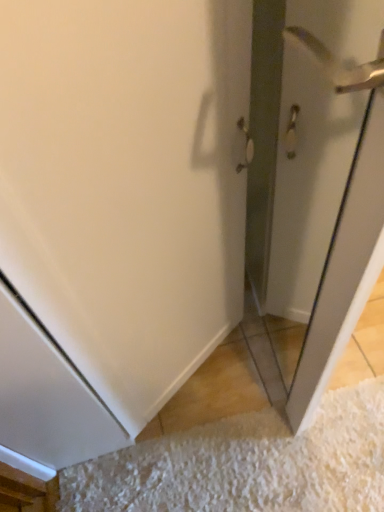
Question: Is clear glass screen door at right bigger than white textured doormat at lower right?

Choices:
 (A) yes
 (B) no

Answer: (A)

Question: Is clear glass screen door at right with white textured doormat at lower right?

Choices:
 (A) yes
 (B) no

Answer: (B)

Question: Is clear glass screen door at right at the left side of white textured doormat at lower right?

Choices:
 (A) no
 (B) yes

Answer: (A)

Question: Considering the relative positions of clear glass screen door at right and white textured doormat at lower right in the image provided, is clear glass screen door at right behind white textured doormat at lower right?

Choices:
 (A) no
 (B) yes

Answer: (A)

Question: Is clear glass screen door at right far from white textured doormat at lower right?

Choices:
 (A) yes
 (B) no

Answer: (B)

Question: Is white textured doormat at lower right spatially inside polished silver door handle at upper right, or outside of it?

Choices:
 (A) outside
 (B) inside

Answer: (A)

Question: From the image's perspective, relative to polished silver door handle at upper right, is white textured doormat at lower right above or below?

Choices:
 (A) below
 (B) above

Answer: (A)

Question: From a real-world perspective, is white textured doormat at lower right positioned above or below polished silver door handle at upper right?

Choices:
 (A) below
 (B) above

Answer: (A)

Question: From their relative heights in the image, would you say white textured doormat at lower right is taller or shorter than polished silver door handle at upper right?

Choices:
 (A) tall
 (B) short

Answer: (B)

Question: Considering the positions of clear glass screen door at right and white textured doormat at lower right in the image, is clear glass screen door at right taller or shorter than white textured doormat at lower right?

Choices:
 (A) short
 (B) tall

Answer: (B)

Question: From the image's perspective, is clear glass screen door at right located above or below white textured doormat at lower right?

Choices:
 (A) above
 (B) below

Answer: (A)

Question: Would you say clear glass screen door at right is to the left or to the right of white textured doormat at lower right in the picture?

Choices:
 (A) left
 (B) right

Answer: (B)

Question: Is clear glass screen door at right inside or outside of white textured doormat at lower right?

Choices:
 (A) inside
 (B) outside

Answer: (B)

Question: Visually, is polished silver door handle at upper right positioned to the left or to the right of white textured doormat at lower right?

Choices:
 (A) left
 (B) right

Answer: (B)

Question: From the image's perspective, is polished silver door handle at upper right positioned above or below white textured doormat at lower right?

Choices:
 (A) below
 (B) above

Answer: (B)